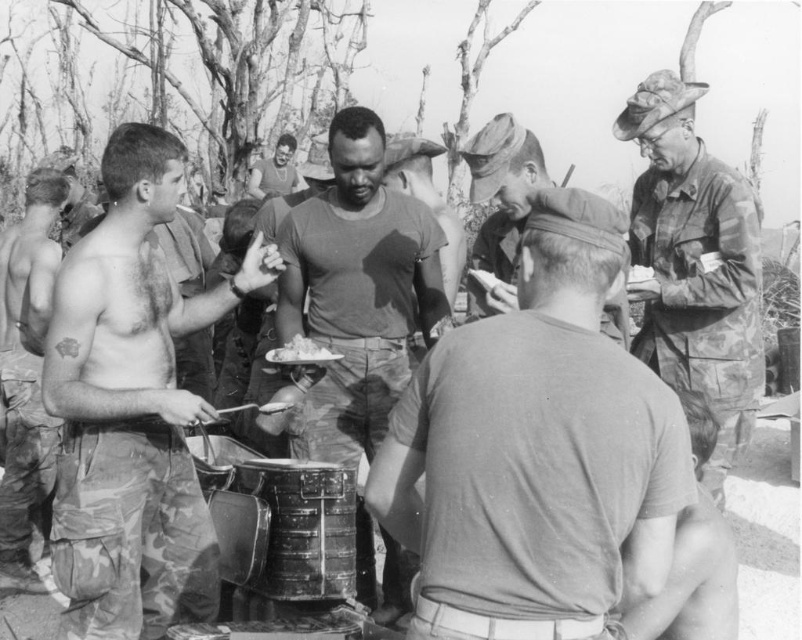
Who is positioned more to the left, camouflage uniform at right or dark skin/smooth face at center?

From the viewer's perspective, dark skin/smooth face at center appears more on the left side.

Who is more forward, [703,480] or [258,163]?

Point [703,480] is more forward.

Locate an element on the screen. camouflage uniform at right is located at coordinates click(695, 262).

Who is higher up, gray matte shirt at center or camouflage uniform at center?

Positioned higher is camouflage uniform at center.

Which is below, gray matte shirt at center or camouflage uniform at center?

gray matte shirt at center is below.

Does point (480, 355) lie behind point (487, 292)?

No, (480, 355) is closer to viewer.

Where is `gray matte shirt at center`? The image size is (802, 640). gray matte shirt at center is located at coordinates (553, 465).

Between point (13, 285) and point (504, 257), which one is positioned behind?

The point (13, 285) is more distant.

Which is in front, point (47, 280) or point (610, 298)?

Point (610, 298) is more forward.

Describe the element at coordinates (26, 374) in the screenshot. The width and height of the screenshot is (802, 640). I see `camouflage uniform at left` at that location.

Locate an element on the screen. The image size is (802, 640). camouflage uniform at left is located at coordinates coord(26,374).